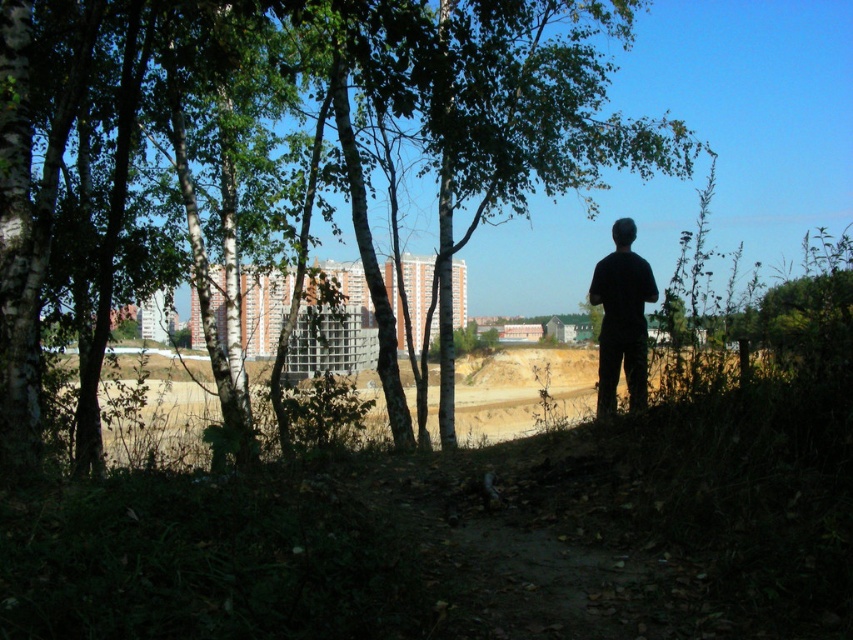
Does green leafy tree at center lie in front of black matte shirt at center?

Yes, green leafy tree at center is in front of black matte shirt at center.

Does green leafy tree at center have a larger size compared to black matte shirt at center?

Yes.

Who is more distant from viewer, [22,10] or [605,268]?

Point [605,268]

Locate an element on the screen. The height and width of the screenshot is (640, 853). green leafy tree at center is located at coordinates (428, 116).